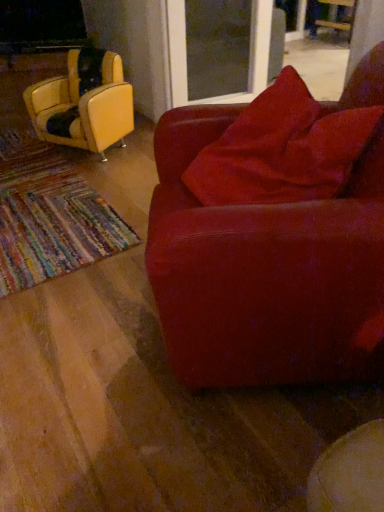
Where is `vacant area situated to the left side of suede-like red couch at center, marked as the 3th chair in a top-to-bottom arrangement`? vacant area situated to the left side of suede-like red couch at center, marked as the 3th chair in a top-to-bottom arrangement is located at coordinates pyautogui.click(x=89, y=351).